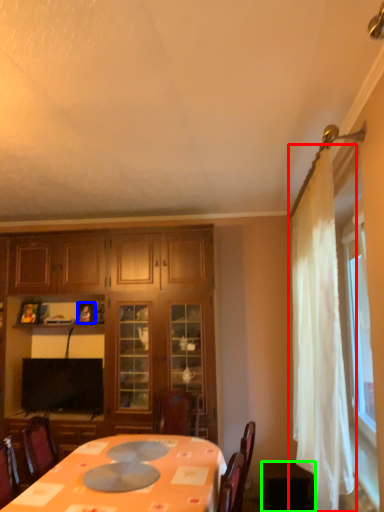
Question: Which object is the farthest from curtain (highlighted by a red box)? Choose among these: picture frame (highlighted by a blue box) or table (highlighted by a green box).

Choices:
 (A) picture frame
 (B) table

Answer: (A)